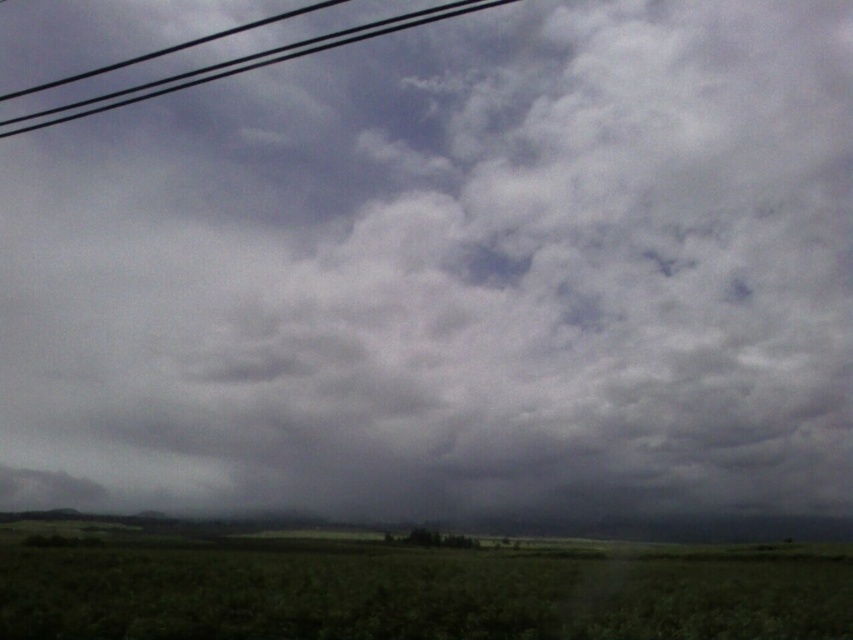
You are a drone operator preparing to land your drone in the open landscape. You see the green grass at lower center and the black wire at upper left. Which object is closer to the ground?

The green grass at lower center is closer to the ground because it is located below the black wire at upper left.

You are standing in the middle of the landscape and want to walk towards the black wire at upper left. Which direction should you look to see the green grass at lower center?

The green grass at lower center is smaller than the black wire at upper left, so you should look downward to see the green grass at lower center since it is located below your current position.

You are a gardener who needs to trim the green grass at lower center to match the height of the black wire at upper left. Based on the scene description, can you determine if the grass is currently shorter or taller than the wire?

The green grass at lower center is shorter than the black wire at upper left, so it is already shorter and does not need trimming to match the wire.